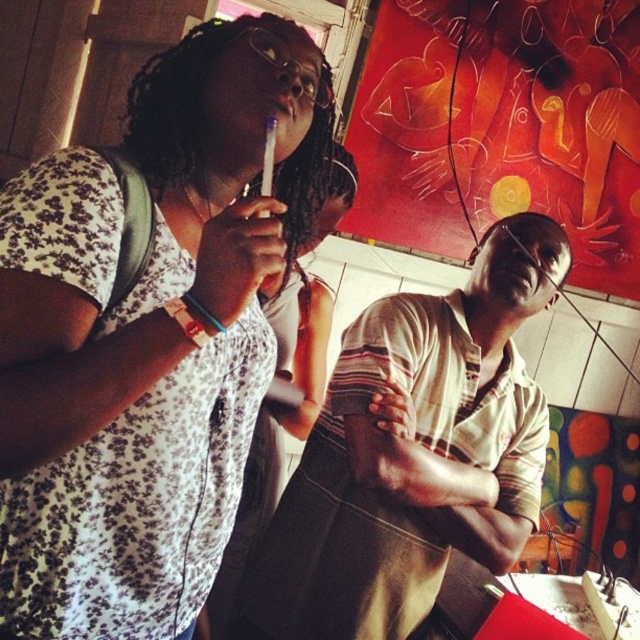
Question: Which object is farther from the camera taking this photo?

Choices:
 (A) matte black shirt at center
 (B) striped cotton shirt at center
 (C) floral fabric dress at upper left

Answer: (B)

Question: Is striped cotton shirt at center positioned behind matte black shirt at center?

Choices:
 (A) yes
 (B) no

Answer: (A)

Question: Which point is closer to the camera?

Choices:
 (A) (362, 572)
 (B) (45, 440)

Answer: (B)

Question: Which object is the closest to the striped cotton shirt at center?

Choices:
 (A) floral fabric dress at upper left
 (B) matte plastic mouth at center

Answer: (A)

Question: Can you confirm if striped cotton shirt at center is thinner than matte black shirt at center?

Choices:
 (A) no
 (B) yes

Answer: (A)

Question: Considering the relative positions of striped cotton shirt at center and matte black shirt at center in the image provided, where is striped cotton shirt at center located with respect to matte black shirt at center?

Choices:
 (A) above
 (B) below

Answer: (A)